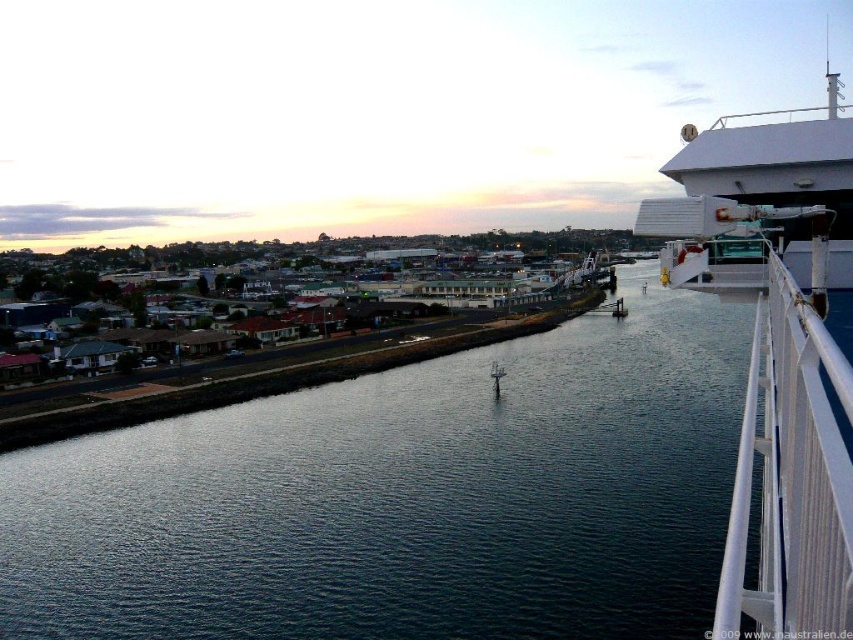
You are standing on the shore looking out at the dark blue water at center and the white textured rail at right. Which object is closer to you?

The dark blue water at center is closer to you because it is further to the viewer than the white textured rail at right, meaning it appears nearer in the scene.

You are standing at the center of the image and want to locate the white textured rail at right. In which direction should you look?

You should look to the right to find the white textured rail at right.

You are standing on the deck of a ship and see the white textured rail at right. If you want to move closer to it, which direction should you move?

You should move to your right because the white textured rail at right is located to your right side, so moving in that direction will bring you closer to it.